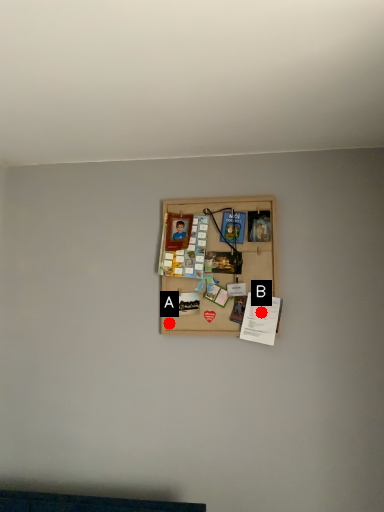
Question: Two points are circled on the image, labeled by A and B beside each circle. Among these points, which one is farthest from the camera?

Choices:
 (A) A is further
 (B) B is further

Answer: (A)